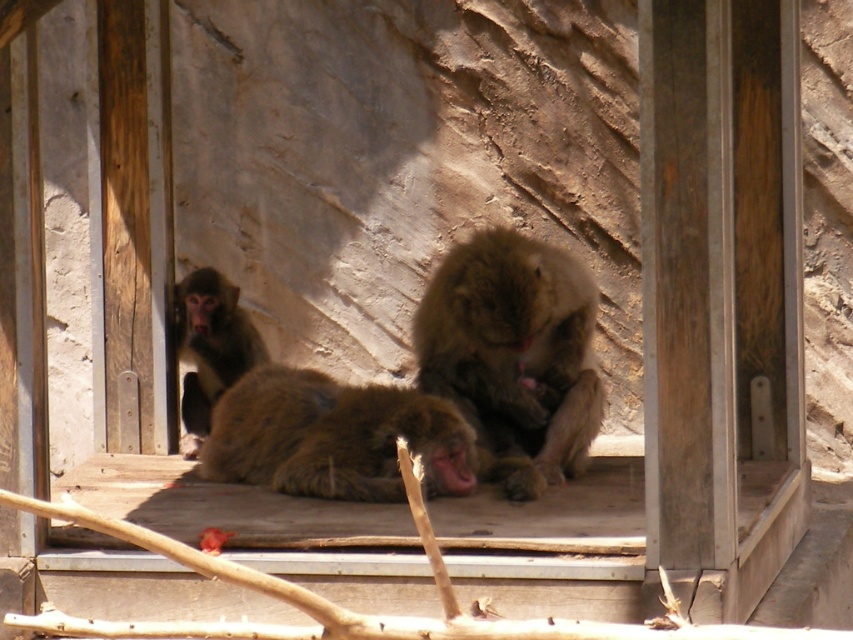
Based on the photo, you are a zookeeper observing the snow monkeys in their enclosure. You notice two monkeys at the center of the scene. One is labeled as the brown furry monkey at center and the other as the fuzzy brown monkey at center. Based on their positions, which monkey is standing taller?

The brown furry monkey at center is much taller than the fuzzy brown monkey at center, so it is standing taller.

You are a zookeeper observing the snow monkeys in their enclosure. You notice two specific points marked in the image. From your vantage point, which of the two points, point (x=300, y=464) or point (x=219, y=364), is closer to you?

Point (x=300, y=464) is in front of point (x=219, y=364), so it is closer to you.